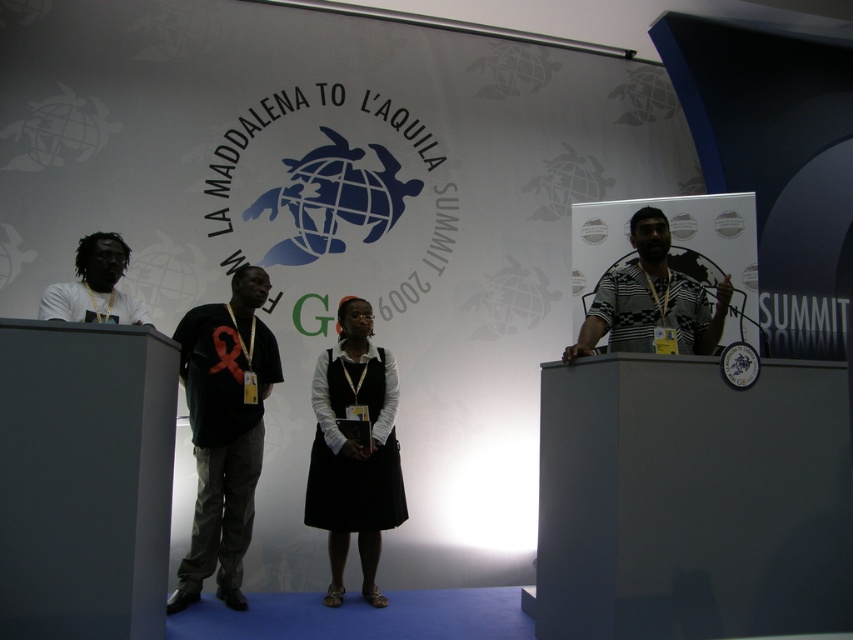
Does point (231, 392) lie behind point (54, 289)?

Yes, point (231, 392) is farther from viewer.

Where is `black matte t-shirt at center`? This screenshot has height=640, width=853. black matte t-shirt at center is located at coordinates (224, 429).

The image size is (853, 640). Identify the location of black matte t-shirt at center. (224, 429).

Is point (190, 321) positioned in front of point (358, 365)?

Yes, it is.

How far apart are black matte t-shirt at center and black matte dress at center?

A distance of 18.67 inches exists between black matte t-shirt at center and black matte dress at center.

Is point (222, 474) more distant than point (341, 406)?

No, it is in front of (341, 406).

Locate an element on the screen. Image resolution: width=853 pixels, height=640 pixels. black matte t-shirt at center is located at coordinates (224, 429).

Looking at this image, who is lower down, striped fabric shirt at right or matte white shirt at left?

striped fabric shirt at right is below.

Can you confirm if striped fabric shirt at right is taller than matte white shirt at left?

Yes, striped fabric shirt at right is taller than matte white shirt at left.

Describe the element at coordinates (651, 300) in the screenshot. I see `striped fabric shirt at right` at that location.

Find the location of a particular element. The image size is (853, 640). striped fabric shirt at right is located at coordinates [x=651, y=300].